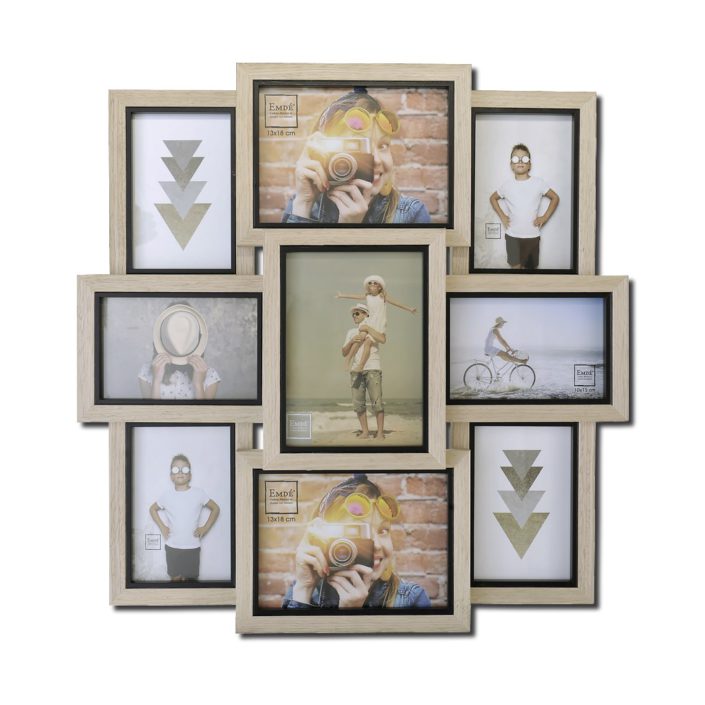
This screenshot has height=705, width=705. I want to click on photos in collage, so click(214, 183), click(202, 341), click(199, 482), click(338, 521), click(529, 510), click(529, 337), click(338, 352), click(366, 175), click(508, 177).